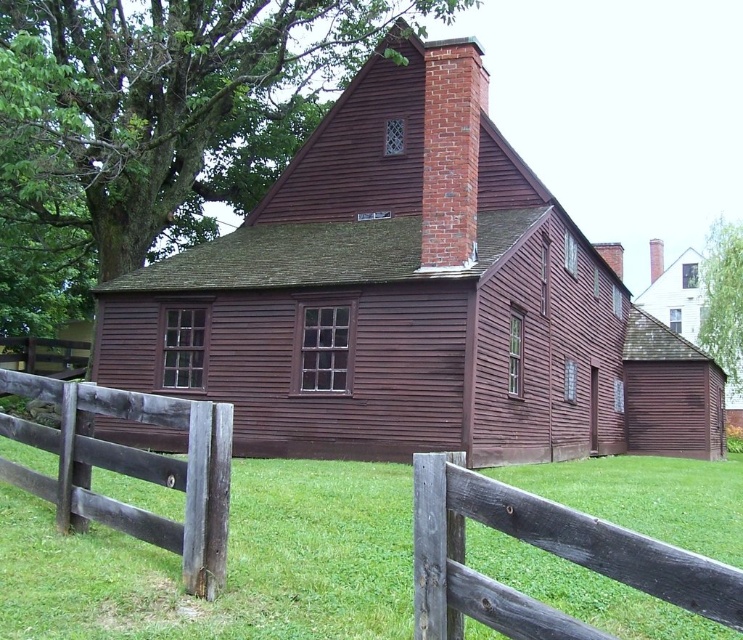
Is matte wooden barn at center in front of gray wooden fence at center?

That is False.

Which is above, matte wooden barn at center or gray wooden fence at center?

Positioned higher is matte wooden barn at center.

Where is `matte wooden barn at center`? matte wooden barn at center is located at coordinates (389, 291).

Who is more forward, (450, 524) or (661, 259)?

Point (450, 524) is more forward.

Can you confirm if gray wooden fence at center is thinner than brick chimney at center?

Indeed, gray wooden fence at center has a lesser width compared to brick chimney at center.

Who is more distant from viewer, (675, 557) or (655, 275)?

Point (655, 275)

Locate an element on the screen. The width and height of the screenshot is (743, 640). gray wooden fence at center is located at coordinates (545, 550).

Does gray wooden fence at center appear on the right side of white wood barn at upper right?

In fact, gray wooden fence at center is to the left of white wood barn at upper right.

Looking at this image, is gray wooden fence at center to the left of white wood barn at upper right from the viewer's perspective?

Indeed, gray wooden fence at center is positioned on the left side of white wood barn at upper right.

Locate an element on the screen. gray wooden fence at center is located at coordinates (545, 550).